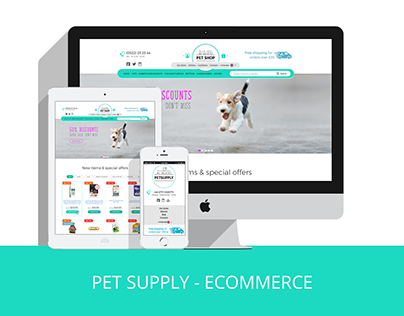
Locate an element on the screen. This screenshot has height=316, width=404. computer monitor is located at coordinates (301, 159).